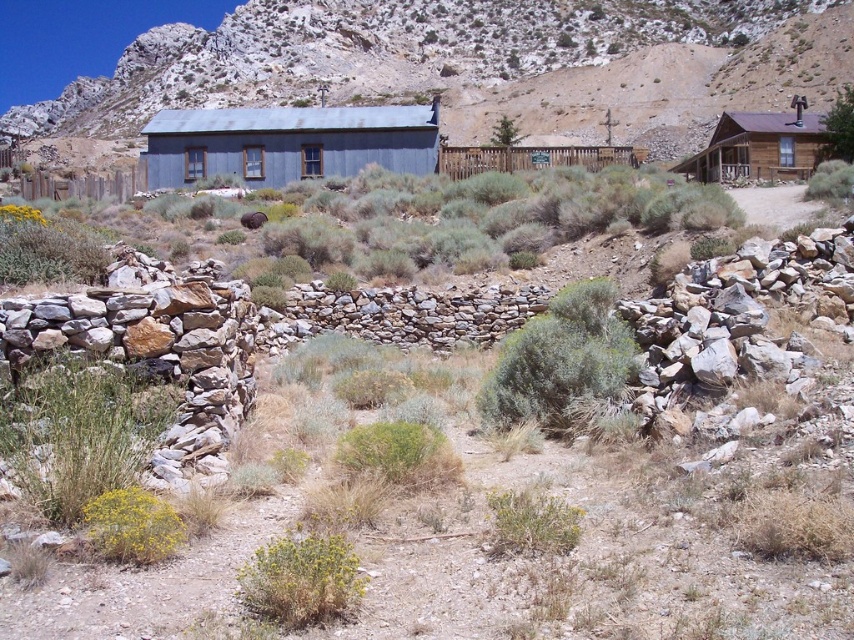
Question: Is rugged stone mountain at upper center smaller than yellow-green shrub at lower left?

Choices:
 (A) yes
 (B) no

Answer: (B)

Question: Which point is closer to the camera taking this photo?

Choices:
 (A) (155, 104)
 (B) (56, 248)

Answer: (B)

Question: Which point is farther from the camera taking this photo?

Choices:
 (A) (102, 243)
 (B) (203, 166)

Answer: (B)

Question: Is yellow-green shrub at center below green leafy bush at upper right?

Choices:
 (A) no
 (B) yes

Answer: (B)

Question: Among these objects, which one is nearest to the camera?

Choices:
 (A) blue corrugated metal cabin at center
 (B) green leafy bush at upper right
 (C) brown wooden cabin at upper right

Answer: (C)

Question: Can you confirm if rugged stone mountain at upper center is positioned above yellow-green shrub at center?

Choices:
 (A) no
 (B) yes

Answer: (B)